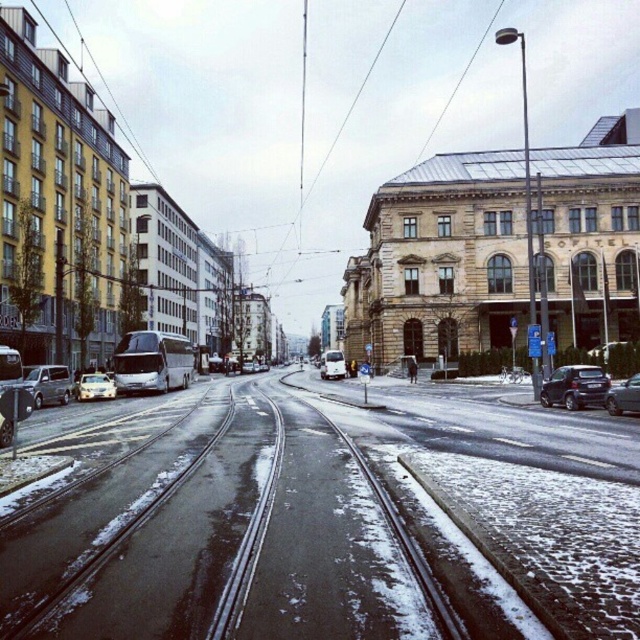
Question: Which is nearer to the silver metallic sedan at center?

Choices:
 (A) metallic silver sedan at lower right
 (B) satin silver van at center-left

Answer: (B)

Question: Is shiny black sedan at lower right wider than satin silver van at center-left?

Choices:
 (A) no
 (B) yes

Answer: (A)

Question: Among these points, which one is nearest to the camera?

Choices:
 (A) pos(67,369)
 (B) pos(628,408)
 (C) pos(81,387)

Answer: (B)

Question: Which object is the farthest from the white matte van at center?

Choices:
 (A) shiny black sedan at lower right
 (B) metallic silver sedan at lower right

Answer: (B)

Question: Can you confirm if metallic silver sedan at lower right is smaller than silver metallic sedan at center?

Choices:
 (A) no
 (B) yes

Answer: (A)

Question: Is silver metallic sedan at center to the left of white matte van at center from the viewer's perspective?

Choices:
 (A) yes
 (B) no

Answer: (A)